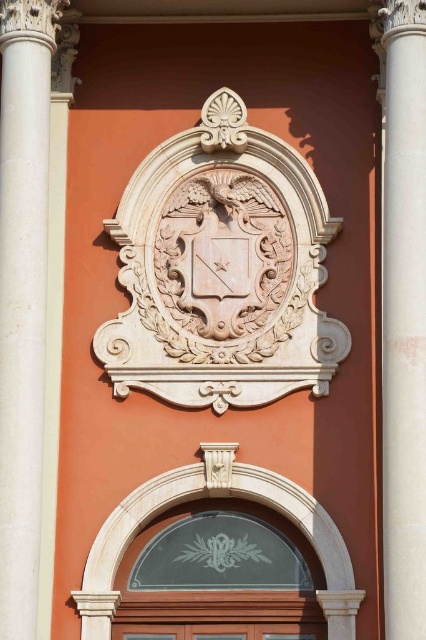
Question: Can you confirm if clear glass door at center is positioned above wooden door at lower center?

Choices:
 (A) yes
 (B) no

Answer: (A)

Question: Is white stone coat of arms at center to the right of clear glass door at center from the viewer's perspective?

Choices:
 (A) yes
 (B) no

Answer: (A)

Question: Is clear glass door at center thinner than wooden door at lower center?

Choices:
 (A) no
 (B) yes

Answer: (A)

Question: Among these objects, which one is nearest to the camera?

Choices:
 (A) white marble column at right
 (B) white marble column at center
 (C) white stone coat of arms at center

Answer: (A)

Question: Which point is farther to the camera?

Choices:
 (A) clear glass door at center
 (B) white marble column at right
 (C) wooden door at lower center
 (D) white stone coat of arms at center

Answer: (D)

Question: Which point is closer to the camera?

Choices:
 (A) (258, 627)
 (B) (97, 548)

Answer: (B)